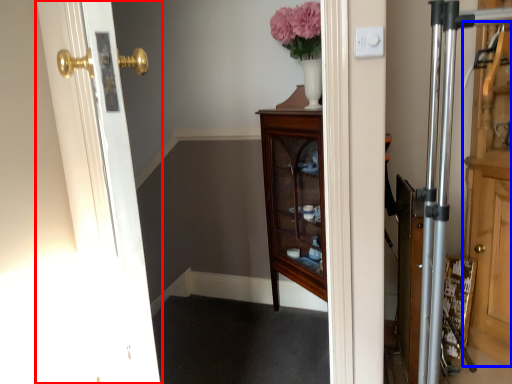
Question: Which point is closer to the camera, door (highlighted by a red box) or dresser (highlighted by a blue box)?

Choices:
 (A) door
 (B) dresser

Answer: (A)